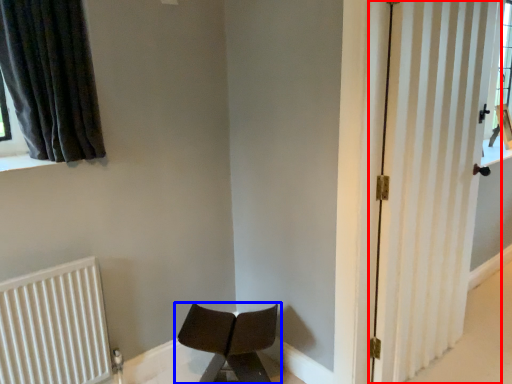
Question: Which object is closer to the camera taking this photo, door (highlighted by a red box) or chair (highlighted by a blue box)?

Choices:
 (A) door
 (B) chair

Answer: (A)